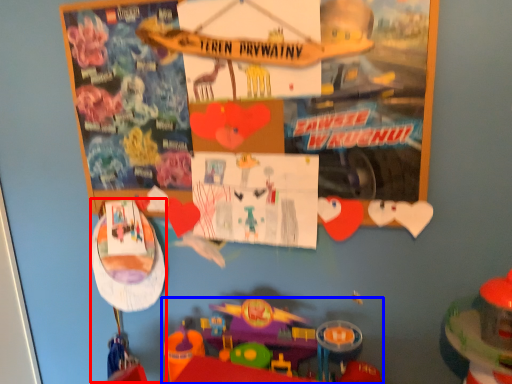
Question: Which of the following is the farthest to the observer, toy (highlighted by a red box) or toy (highlighted by a blue box)?

Choices:
 (A) toy
 (B) toy

Answer: (A)